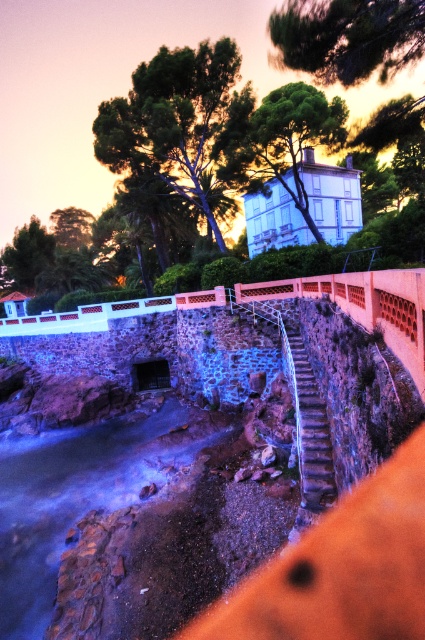
Looking at this image, you are a hiker who wants to take a photo of the green leafy tree at upper center and the metallic silver stairs at center from a distance where both can be seen clearly in the frame. What is the minimum distance you need to stand away from the closest object to ensure both are in the frame?

The minimum distance you need to stand away from the closest object is 14.14 meters to ensure both the green leafy tree at upper center and the metallic silver stairs at center are in the frame.

You are standing at the base of the metallic silver stairs at center and want to reach the green leafy tree at upper center. Which direction should you move to get closer to the tree?

To reach the green leafy tree at upper center, you should move upwards since the tree is further away from you compared to the stairs.